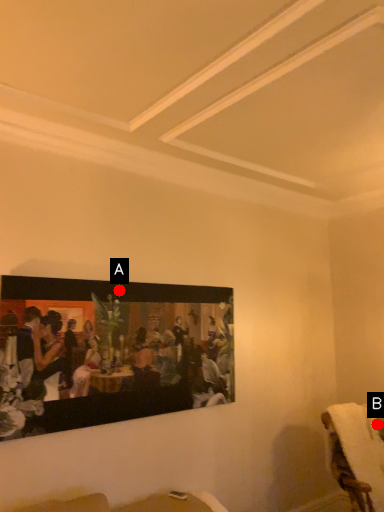
Question: Two points are circled on the image, labeled by A and B beside each circle. Which point appears farthest from the camera in this image?

Choices:
 (A) A is further
 (B) B is further

Answer: (B)